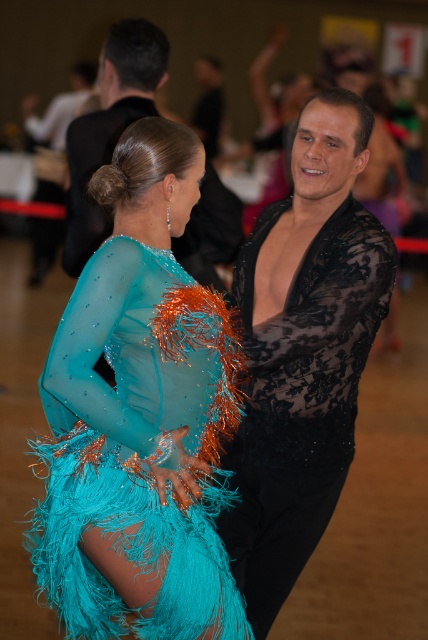
Question: Does turquoise sheer dress at center have a lesser width compared to black lace shirt at upper center?

Choices:
 (A) yes
 (B) no

Answer: (B)

Question: Among these points, which one is farthest from the camera?

Choices:
 (A) click(116, 134)
 (B) click(201, 515)

Answer: (A)

Question: Considering the relative positions of turquoise sheer dress at center and black lace shirt at upper center in the image provided, where is turquoise sheer dress at center located with respect to black lace shirt at upper center?

Choices:
 (A) left
 (B) right

Answer: (B)

Question: Is turquoise sheer dress at center positioned behind black lace shirt at upper center?

Choices:
 (A) no
 (B) yes

Answer: (A)

Question: Which of the following is the closest to the observer?

Choices:
 (A) black lace shirt at upper center
 (B) black lace shirt at center
 (C) turquoise sheer dress at center

Answer: (C)

Question: Which point is closer to the camera taking this photo?

Choices:
 (A) (152, 259)
 (B) (118, 108)

Answer: (A)